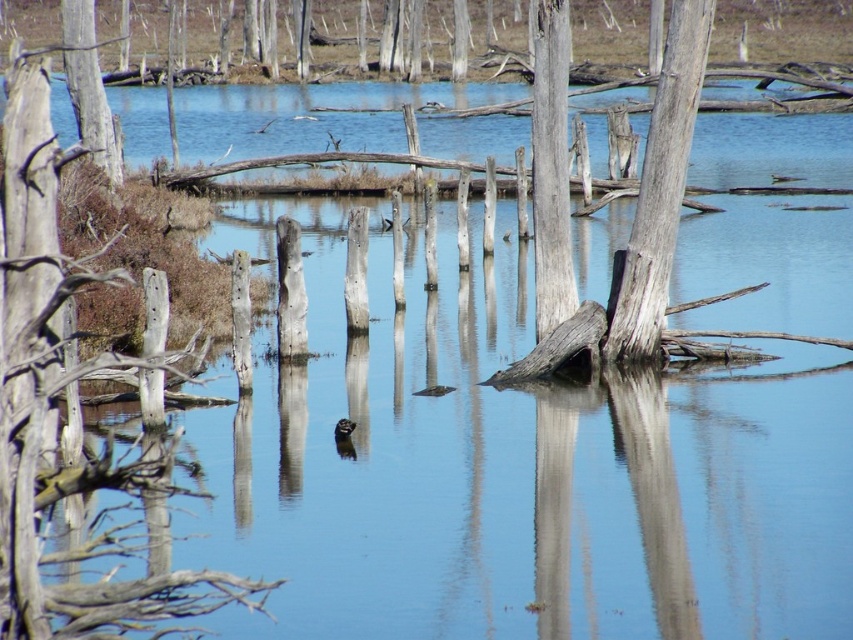
Is point (694, 72) farther from camera compared to point (76, 77)?

No, it is not.

Who is positioned more to the left, gray wood tree trunk at center or smooth gray tree trunk at upper left?

Positioned to the left is smooth gray tree trunk at upper left.

Find the location of a particular element. The width and height of the screenshot is (853, 640). gray wood tree trunk at center is located at coordinates (660, 188).

The height and width of the screenshot is (640, 853). In order to click on gray wood tree trunk at center in this screenshot , I will do `click(660, 188)`.

Identify the location of gray rough wood at center. pyautogui.click(x=550, y=168).

Who is positioned more to the left, gray rough wood at center or smooth gray tree trunk at upper left?

smooth gray tree trunk at upper left is more to the left.

Locate an element on the screen. The width and height of the screenshot is (853, 640). gray rough wood at center is located at coordinates (550, 168).

The image size is (853, 640). Identify the location of gray rough wood at center. (550, 168).

Is gray wood tree trunk at center bigger than gray rough wood at center?

Correct, gray wood tree trunk at center is larger in size than gray rough wood at center.

Can you confirm if gray wood tree trunk at center is wider than gray rough wood at center?

Yes.

Image resolution: width=853 pixels, height=640 pixels. Identify the location of gray wood tree trunk at center. (660, 188).